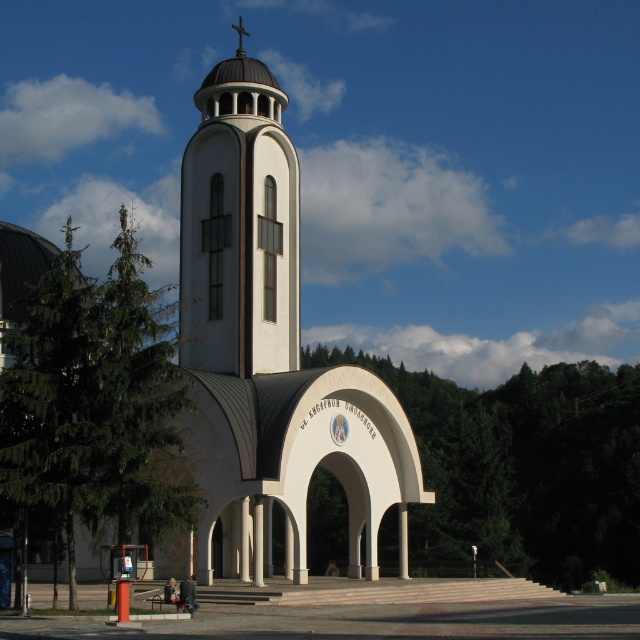
Does point (248, 540) lie behind point (403, 540)?

No, it is in front of (403, 540).

Between point (250, 557) and point (404, 563), which one is positioned behind?

Positioned behind is point (404, 563).

Is point (244, 538) farther from camera compared to point (404, 547)?

No, it is in front of (404, 547).

Locate an element on the screen. white smooth pillar at center is located at coordinates (244, 540).

Can you confirm if white smooth tower at center is positioned below white smooth pillar at center?

No.

Who is shorter, white smooth tower at center or white smooth pillar at center?

With less height is white smooth pillar at center.

Is point (214, 225) less distant than point (237, 564)?

No, (214, 225) is behind (237, 564).

Locate an element on the screen. Image resolution: width=640 pixels, height=640 pixels. white smooth tower at center is located at coordinates (240, 227).

Where is `white marble pillar at center`? Image resolution: width=640 pixels, height=640 pixels. white marble pillar at center is located at coordinates (257, 541).

Is white marble pillar at center in front of white smooth pillar at center?

Yes, it is.

Measure the distance between white marble pillar at center and camera.

The distance of white marble pillar at center from camera is 57.41 meters.

The width and height of the screenshot is (640, 640). In order to click on white marble pillar at center in this screenshot , I will do `click(257, 541)`.